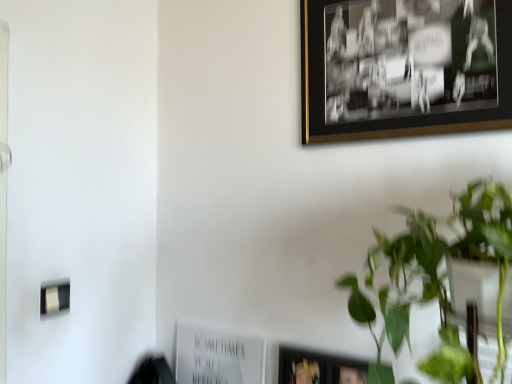
Question: From the image's perspective, does black/golden frame at upper right, marked as the 1th picture frame in a front-to-back arrangement, appear lower than green leafy plant at upper right?

Choices:
 (A) no
 (B) yes

Answer: (A)

Question: Could you tell me if black/golden frame at upper right, acting as the second picture frame starting from the left, is facing green leafy plant at upper right?

Choices:
 (A) no
 (B) yes

Answer: (A)

Question: Does black/golden frame at upper right, which is the second picture frame from bottom to top, have a greater height compared to green leafy plant at upper right?

Choices:
 (A) no
 (B) yes

Answer: (A)

Question: Is black/golden frame at upper right, which ranks as the second picture frame in back-to-front order, shorter than green leafy plant at upper right?

Choices:
 (A) yes
 (B) no

Answer: (A)

Question: From a real-world perspective, does black/golden frame at upper right, acting as the second picture frame starting from the left, stand above green leafy plant at upper right?

Choices:
 (A) yes
 (B) no

Answer: (A)

Question: Does black/golden frame at upper right, acting as the second picture frame starting from the left, have a smaller size compared to green leafy plant at upper right?

Choices:
 (A) no
 (B) yes

Answer: (B)

Question: Is green leafy plant at upper right not close to white paper at lower center, which is the first picture frame in bottom-to-top order?

Choices:
 (A) no
 (B) yes

Answer: (A)

Question: From a real-world perspective, is green leafy plant at upper right positioned over white paper at lower center, the second picture frame when ordered from front to back, based on gravity?

Choices:
 (A) no
 (B) yes

Answer: (B)

Question: Is green leafy plant at upper right to the right of white paper at lower center, marked as the second picture frame in a top-to-bottom arrangement, from the viewer's perspective?

Choices:
 (A) yes
 (B) no

Answer: (A)

Question: Is green leafy plant at upper right aimed at white paper at lower center, which is the first picture frame in bottom-to-top order?

Choices:
 (A) yes
 (B) no

Answer: (B)

Question: Is green leafy plant at upper right in front of white paper at lower center, the first picture frame from the left?

Choices:
 (A) no
 (B) yes

Answer: (B)

Question: Is white paper at lower center, the first picture frame from the left, located within green leafy plant at upper right?

Choices:
 (A) yes
 (B) no

Answer: (B)

Question: Is the position of white paper at lower center, which is the first picture frame in bottom-to-top order, more distant than that of green leafy plant at upper right?

Choices:
 (A) yes
 (B) no

Answer: (A)